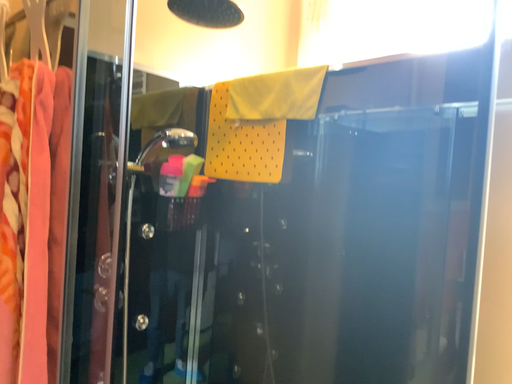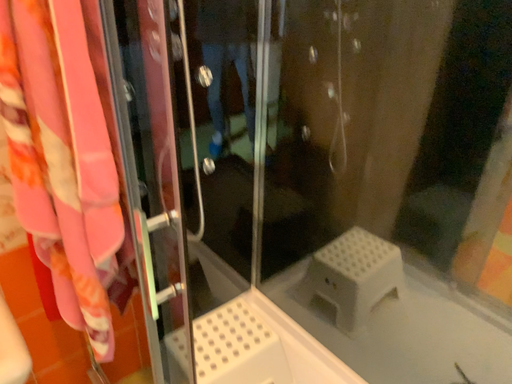
Question: Which way did the camera rotate in the video?

Choices:
 (A) rotated upward
 (B) rotated downward

Answer: (B)